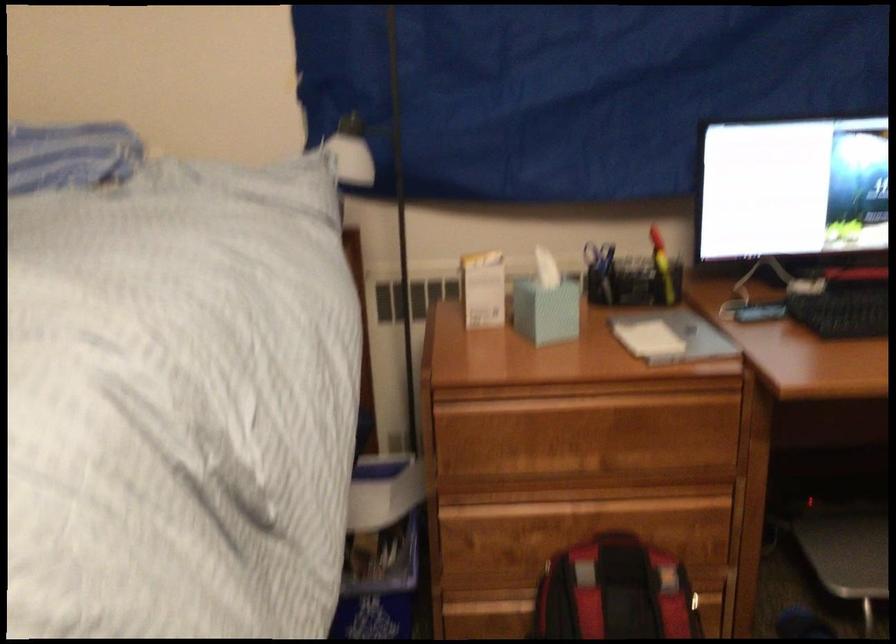
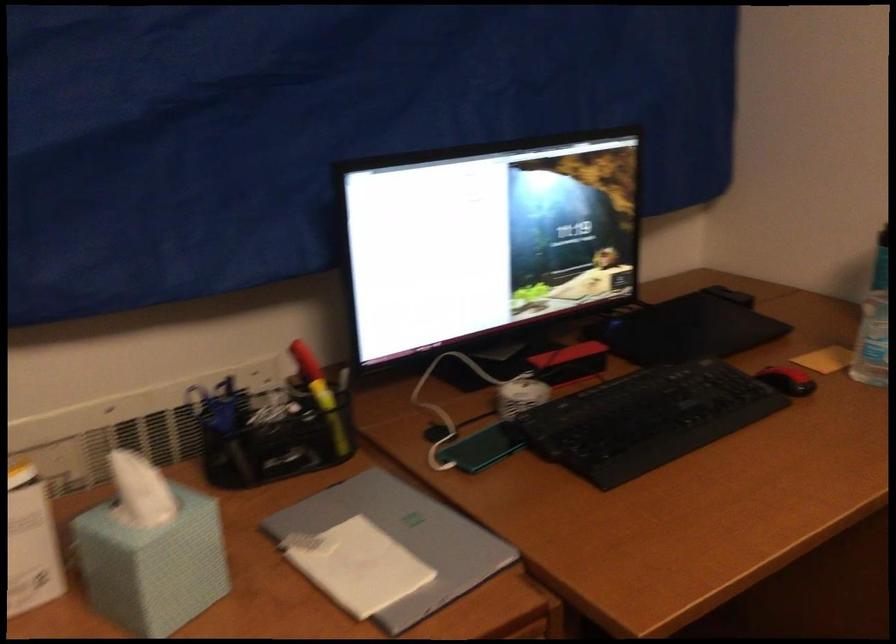
The point at [657,263] is marked in the first image. Where is the corresponding point in the second image?

(321, 395)